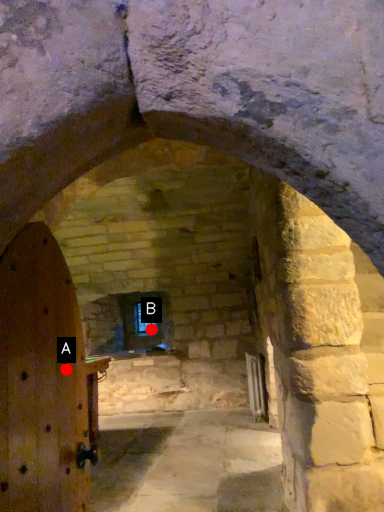
Question: Two points are circled on the image, labeled by A and B beside each circle. Which point appears closest to the camera in this image?

Choices:
 (A) A is closer
 (B) B is closer

Answer: (A)